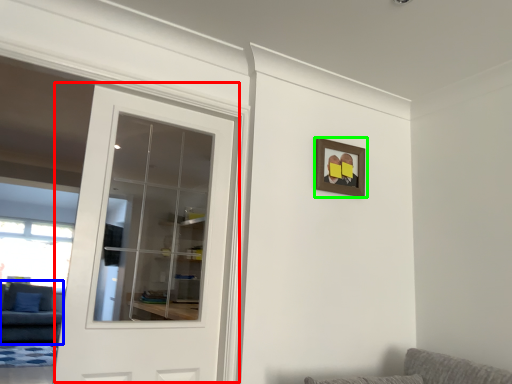
Question: Estimate the real-world distances between objects in this image. Which object is closer to door (highlighted by a red box), couch (highlighted by a blue box) or picture frame (highlighted by a green box)?

Choices:
 (A) couch
 (B) picture frame

Answer: (A)